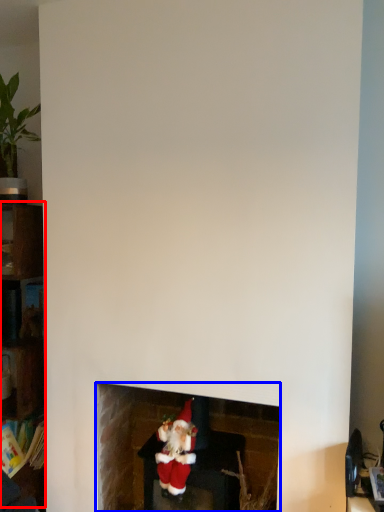
Question: Which point is closer to the camera, shelf (highlighted by a red box) or fireplace (highlighted by a blue box)?

Choices:
 (A) shelf
 (B) fireplace

Answer: (B)